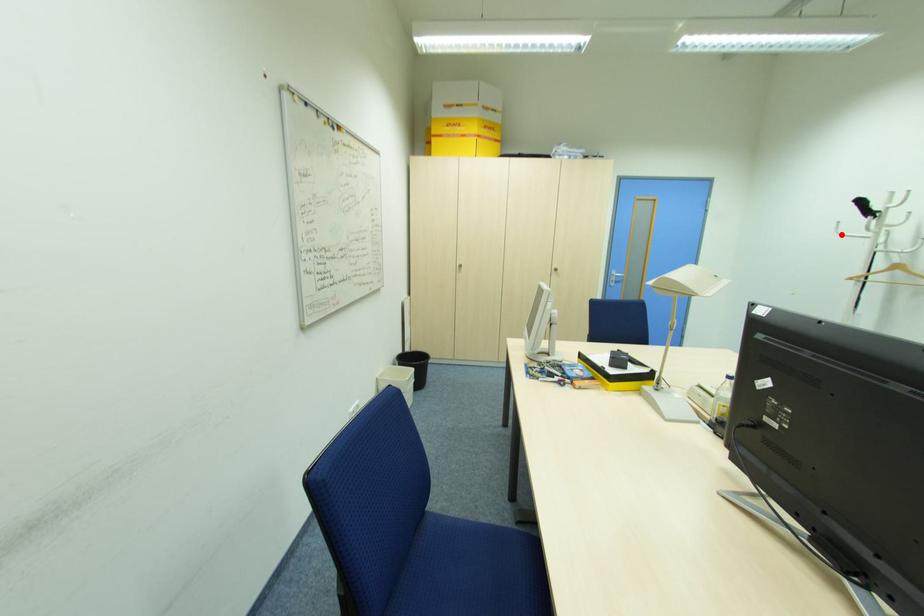
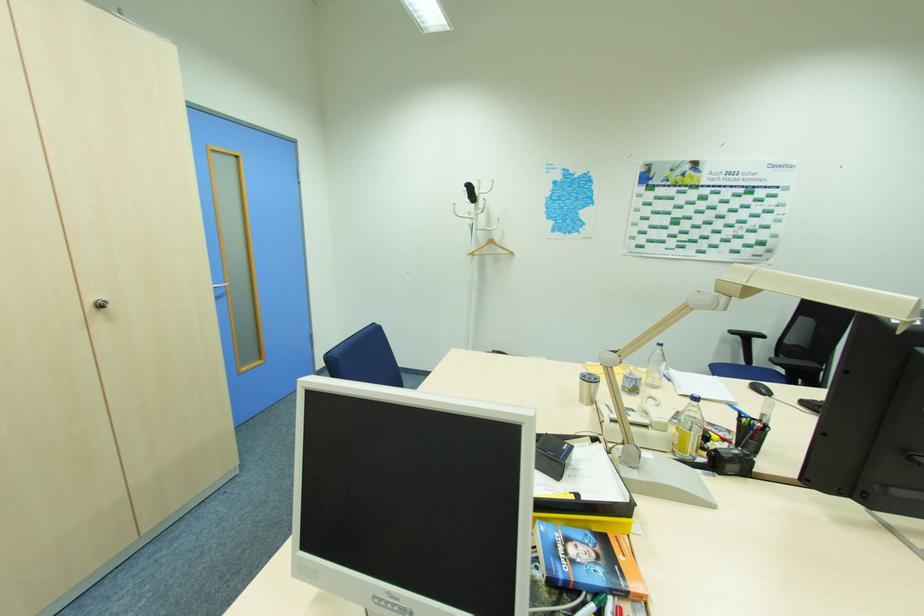
The point at the highlighted location is marked in the first image. Where is the corresponding point in the second image?

(459, 216)